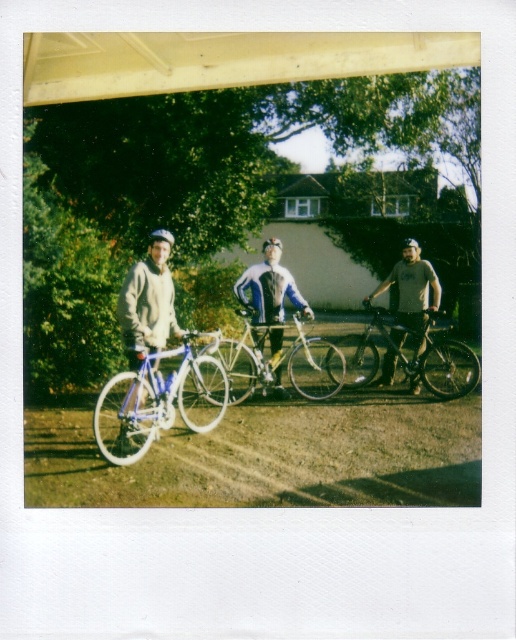
Question: Does shiny silver bicycle at center have a lesser width compared to shiny blue frame at left?

Choices:
 (A) no
 (B) yes

Answer: (A)

Question: Based on their relative distances, which object is nearer to the matte gray shirt at center?

Choices:
 (A) white metallic bicycle at center
 (B) shiny silver bicycle at center
 (C) shiny blue frame at left

Answer: (A)

Question: Which object appears closest to the camera in this image?

Choices:
 (A) shiny silver bicycle at center
 (B) matte black helmet at center

Answer: (A)

Question: Is white gravel at center further to camera compared to matte white bicycle at left?

Choices:
 (A) no
 (B) yes

Answer: (A)

Question: Does matte white bicycle at left have a larger size compared to white metallic bicycle at center?

Choices:
 (A) no
 (B) yes

Answer: (A)

Question: Which of these objects is positioned closest to the shiny black bicycle at center?

Choices:
 (A) shiny blue frame at left
 (B) matte gray shirt at center
 (C) white metallic bicycle at center

Answer: (B)